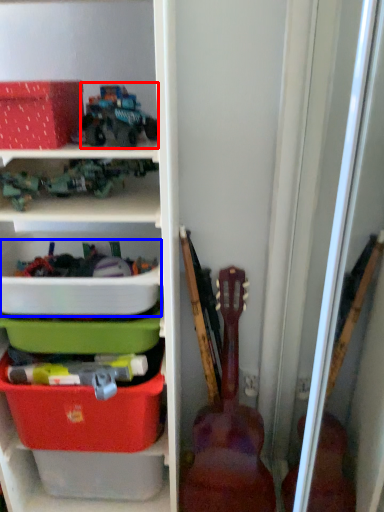
Question: Among these objects, which one is nearest to the camera, toy (highlighted by a red box) or storage box (highlighted by a blue box)?

Choices:
 (A) toy
 (B) storage box

Answer: (A)